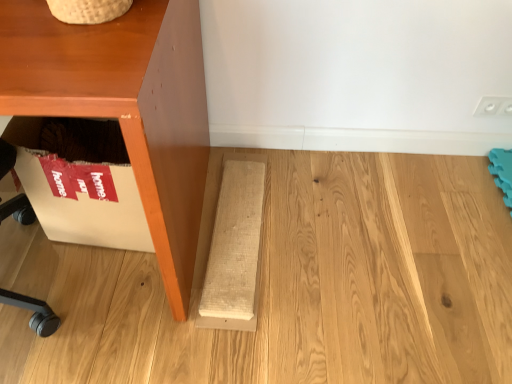
Where is `free space in front of natural wood plank at lower center`? This screenshot has width=512, height=384. free space in front of natural wood plank at lower center is located at coordinates (234, 333).